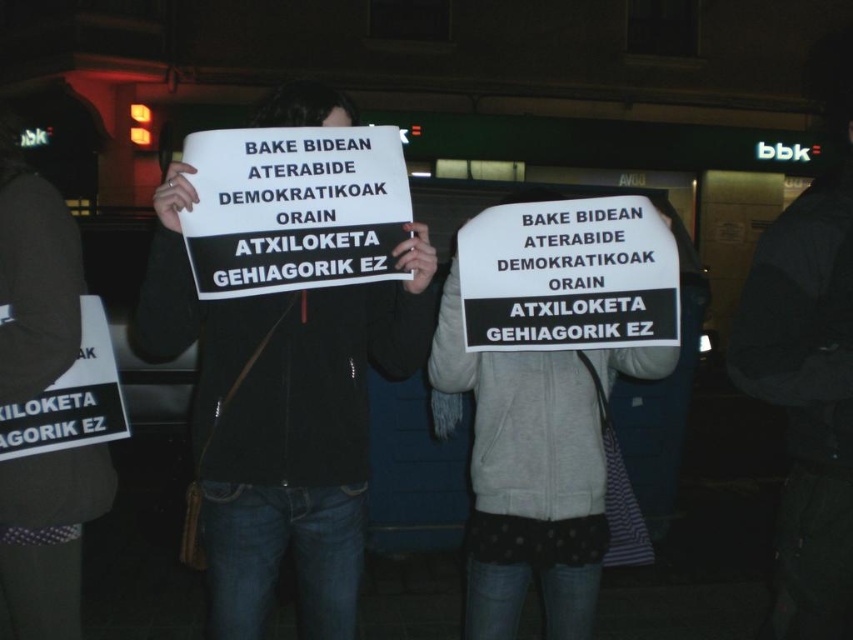
Looking at this image, what are the coordinates of the black matte sign at center?

The black matte sign at center is located at point (281,419).